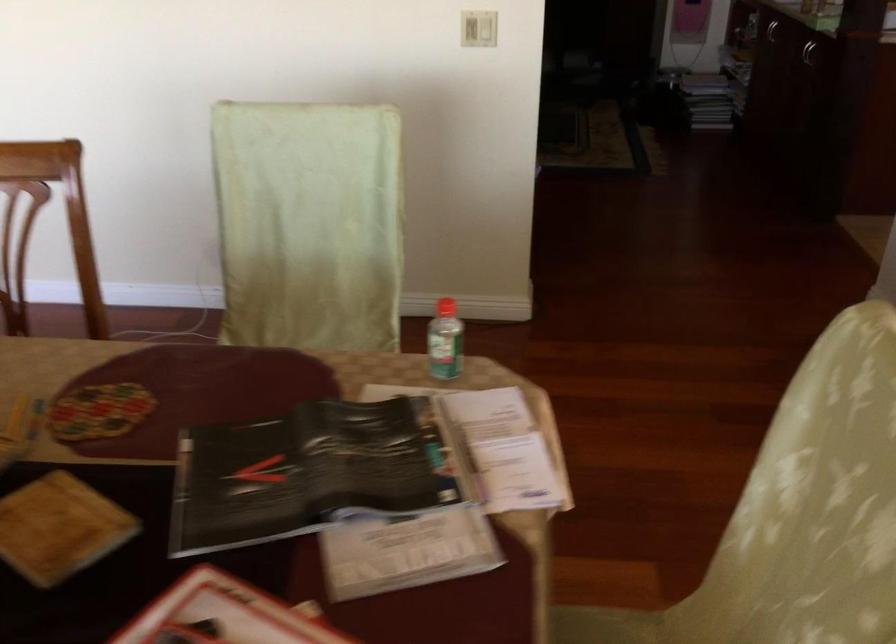
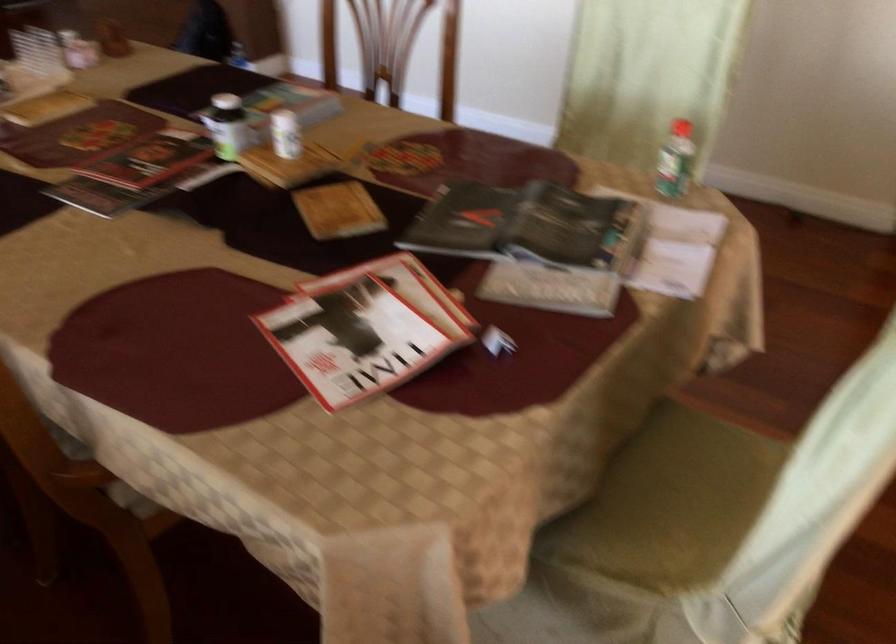
Question: The camera is either moving clockwise (left) or counter-clockwise (right) around the object. The first image is from the beginning of the video and the second image is from the end. Is the camera moving left or right when shooting the video?

Choices:
 (A) Left
 (B) Right

Answer: (B)